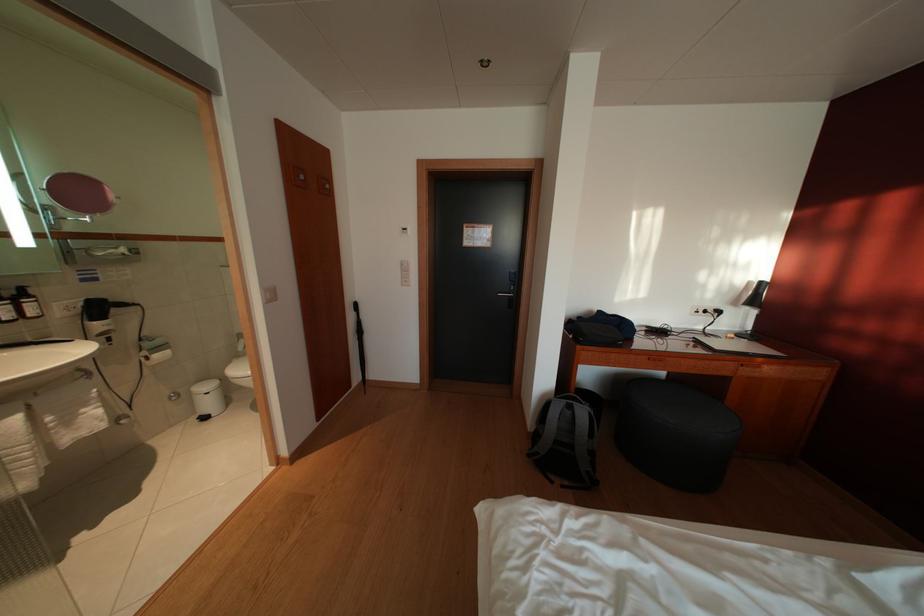
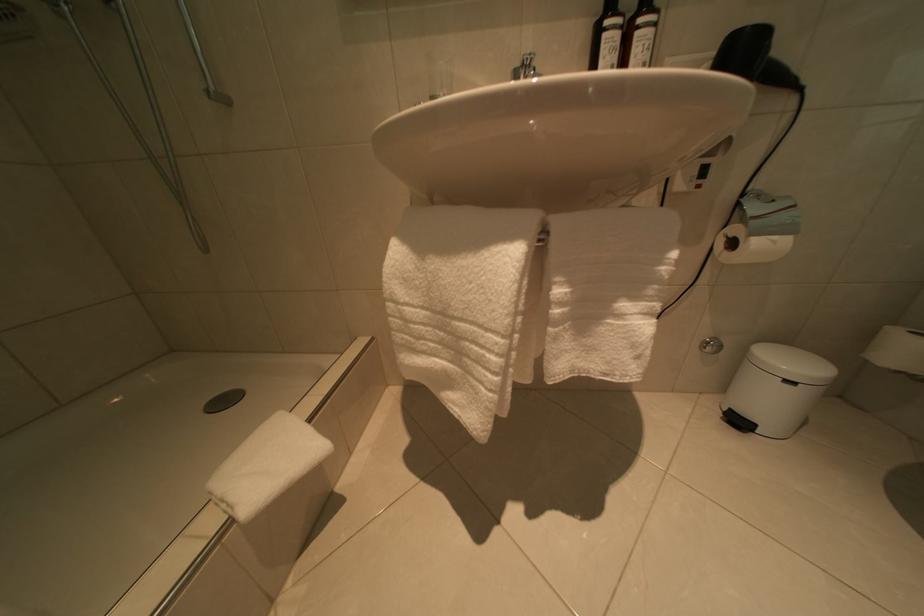
The point at (156, 363) is marked in the first image. Where is the corresponding point in the second image?

(740, 249)